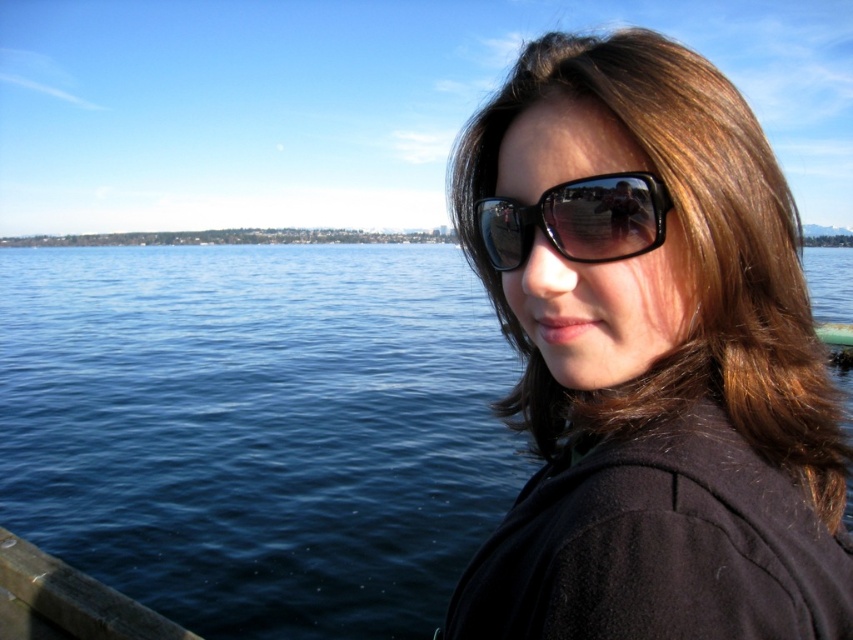
You are a photographer trying to capture a wide shot of the blue water at left and the black reflective sunglasses at center. Based on their sizes in the image, which object would appear larger in the photo?

The blue water at left appears wider than the black reflective sunglasses at center in the image, so it would look larger in the photo.

You are a photographer trying to capture the reflection of the sunglasses at right and the black reflective sunglasses at center in the water. Since the water is calm, you know reflections are clear. Which sunglasses will have their reflection closer to the bottom edge of the water surface?

The sunglasses at right is located below black reflective sunglasses at center, so its reflection will be closer to the bottom edge of the water surface.